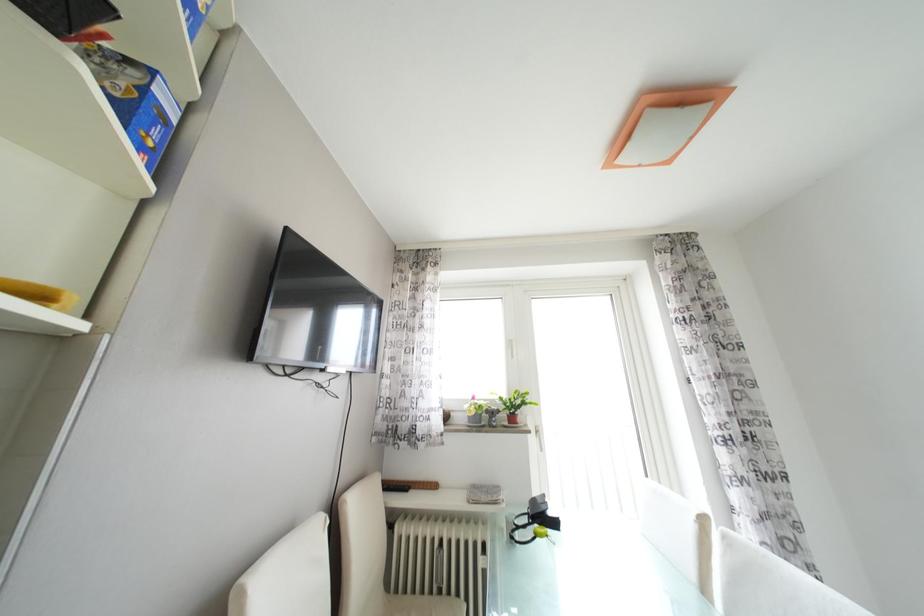
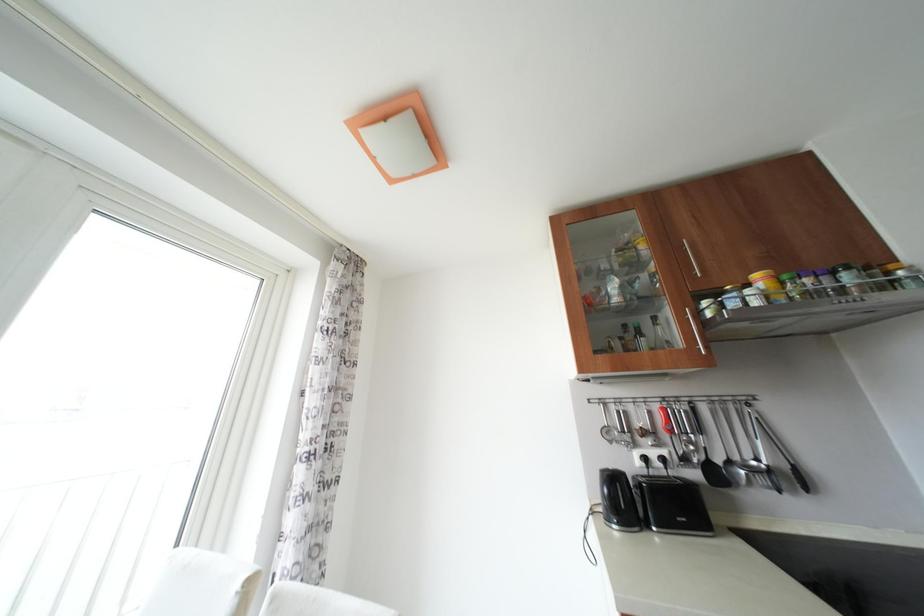
The first image is from the beginning of the video and the second image is from the end. How did the camera likely rotate when shooting the video?

The camera's rotation is toward right-up.